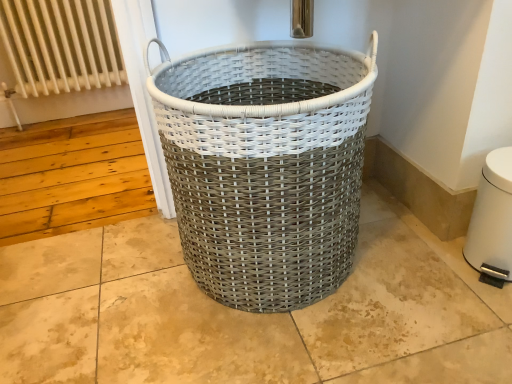
The width and height of the screenshot is (512, 384). In order to click on empty space that is in between white woven basket at center and white plastic water heater at lower right in this screenshot , I will do `click(399, 268)`.